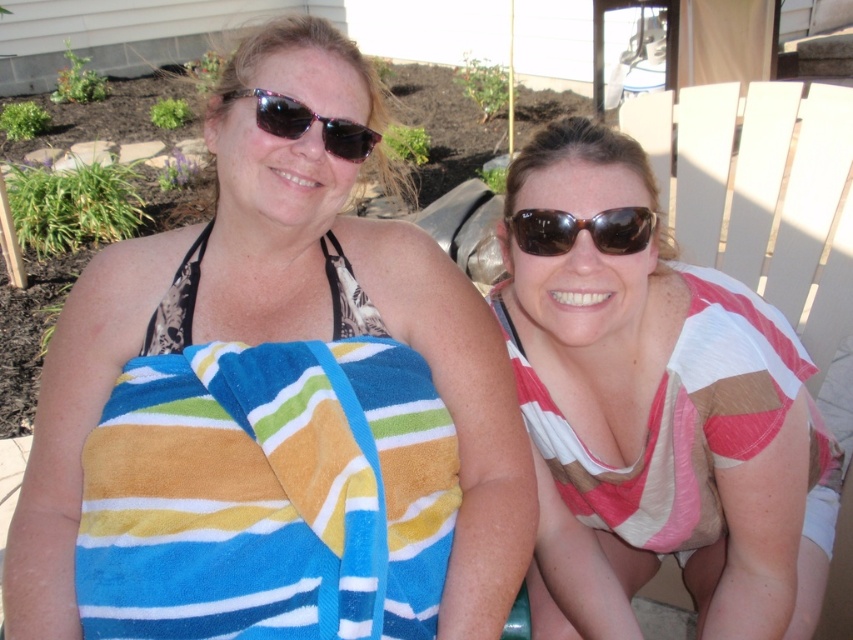
Who is positioned more to the right, striped towel at left or striped cotton beach towel at left?

Positioned to the right is striped cotton beach towel at left.

Between striped towel at left and striped cotton beach towel at left, which one is positioned higher?

Positioned higher is striped towel at left.

What are the coordinates of `striped towel at left` in the screenshot? It's located at (281, 332).

This screenshot has height=640, width=853. I want to click on striped towel at left, so click(281, 332).

Can you confirm if striped towel at left is positioned below matte black sunglasses at upper center?

Yes.

Can you confirm if striped towel at left is smaller than matte black sunglasses at upper center?

Incorrect, striped towel at left is not smaller in size than matte black sunglasses at upper center.

Does point (489, 621) come in front of point (231, 99)?

That is True.

Image resolution: width=853 pixels, height=640 pixels. Find the location of `striped towel at left`. striped towel at left is located at coordinates (281, 332).

In the scene shown: Is striped towel at left thinner than striped fabric shirt at right?

In fact, striped towel at left might be wider than striped fabric shirt at right.

Is striped towel at left above striped fabric shirt at right?

Indeed, striped towel at left is positioned over striped fabric shirt at right.

Does point (39, 609) come behind point (583, 483)?

No.

I want to click on striped towel at left, so click(281, 332).